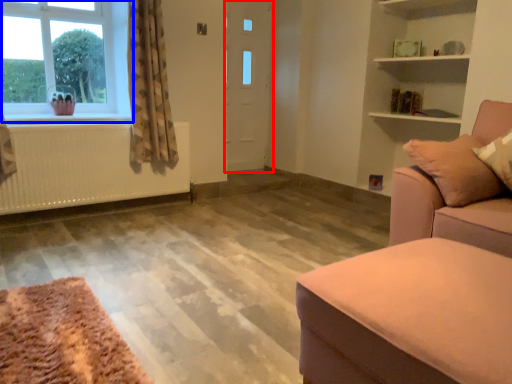
Question: Which object appears closest to the camera in this image, door (highlighted by a red box) or window (highlighted by a blue box)?

Choices:
 (A) door
 (B) window

Answer: (B)